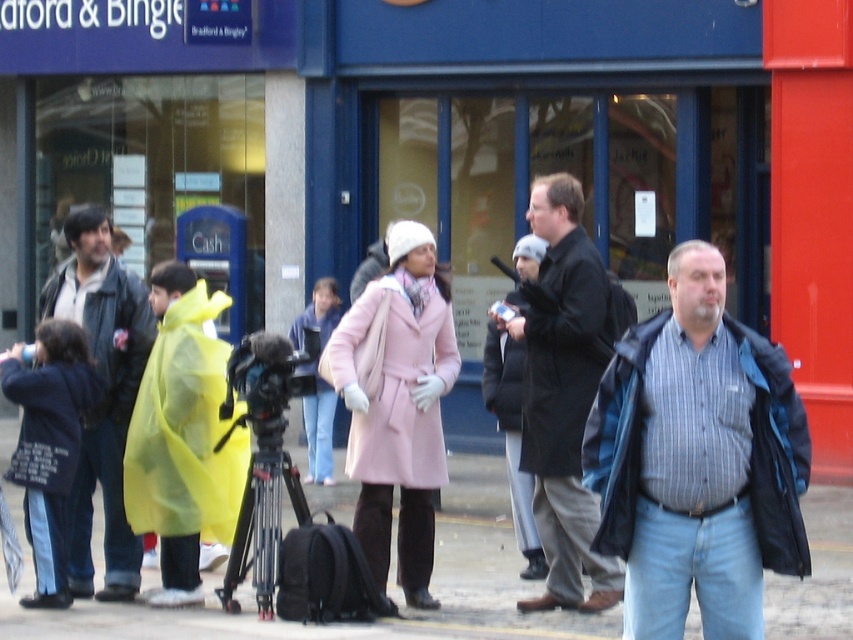
You are a photographer standing behind the camera on the tripod in the foreground. You want to take a photo of the yellow waterproof coat at left without the concrete pavement at center blocking the view. Is this possible?

The yellow waterproof coat at left is behind the concrete pavement at center, so you cannot take a photo of the yellow waterproof coat at left without the concrete pavement at center blocking the view.

You are a photographer standing at the camera on the tripod. You need to capture a photo that includes both the dark blue jacket at left and the matte black jacket at left. Which jacket should you adjust your camera angle to ensure both are fully visible in the frame?

The dark blue jacket at left is much taller than the matte black jacket at left, so you should adjust your camera angle to account for its height to ensure both are fully visible in the frame.

You are a photographer standing at the camera on the tripod. You need to adjust the focus between the dark blue jacket at left and the matte black jacket at left. Which jacket is closer to you?

The distance between the dark blue jacket at left and the matte black jacket at left is 17.50 inches, so the dark blue jacket at left is closer to the photographer since it is positioned in front of the matte black jacket at left by that distance.